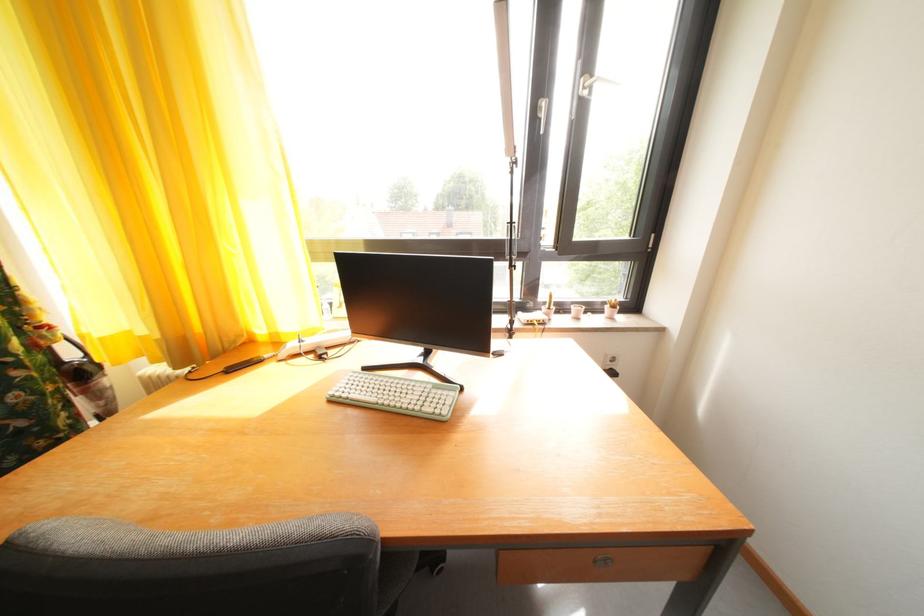
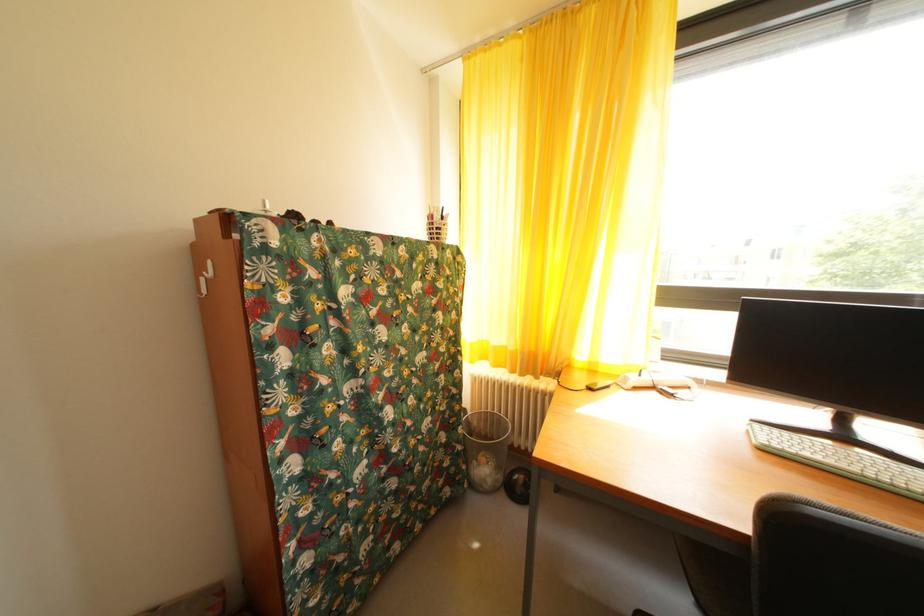
Question: The camera is either moving clockwise (left) or counter-clockwise (right) around the object. The first image is from the beginning of the video and the second image is from the end. Is the camera moving left or right when shooting the video?

Choices:
 (A) Left
 (B) Right

Answer: (B)